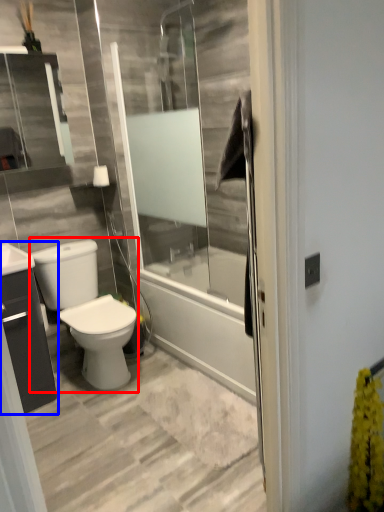
Question: Which of the following is the farthest to the observer, gray (highlighted by a red box) or bathroom cabinet (highlighted by a blue box)?

Choices:
 (A) gray
 (B) bathroom cabinet

Answer: (A)